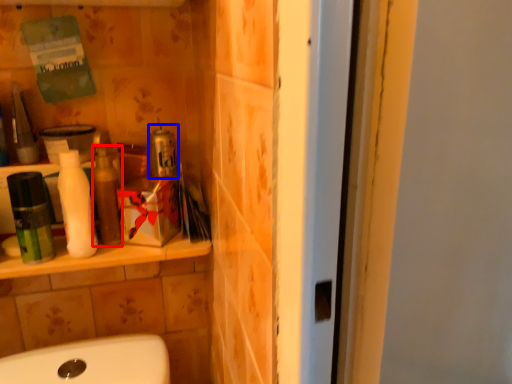
Question: Which point is closer to the camera, toiletry (highlighted by a red box) or product (highlighted by a blue box)?

Choices:
 (A) toiletry
 (B) product

Answer: (A)